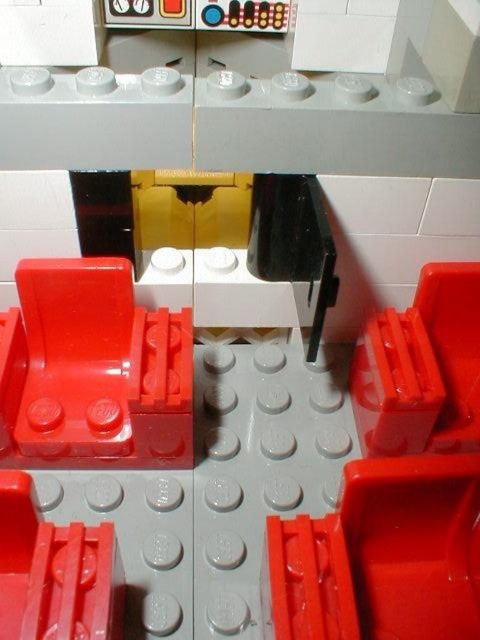
You are building a LEGO set and need to choose between the matte red hinge at center and the matte red hinge at lower left for a specific part that requires a wider piece. Which one should you use?

The matte red hinge at center has a larger width than the matte red hinge at lower left, so you should use the matte red hinge at center for the part that requires a wider piece.

From the picture: You are a LEGO builder standing 1 meter away from the LEGO construction. You need to reach the matte red hinge at center to adjust it. Can you comfortably reach it without moving closer?

The matte red hinge at center is 84.38 centimeters away from the viewer. Since you are standing 1 meter away, which is 100 centimeters, you are 15.62 centimeters farther than the required distance. Therefore, you can comfortably reach it without moving closer.